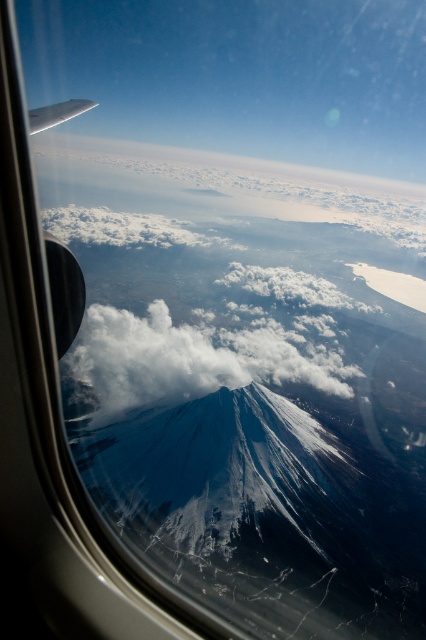
You are a pilot flying an airplane with a wingspan of 30 meters. You notice the white fluffy cloud at center and the white matte wing at upper left in your view. Based on their sizes, which one do you think is farther from the airplane?

The white fluffy cloud at center is larger in width than the white matte wing at upper left, so it is farther away from the airplane.

You are a pilot flying an airplane with a wingspan of 30 meters. You notice the white fluffy cloud at center and the white matte wing at upper left in your view. Which object is taller from your perspective?

The white fluffy cloud at center is taller than the white matte wing at upper left.

You are a passenger on an airplane and looking out the window. You notice the white fluffy cloud at center and the white matte wing at upper left. Which object is closer to the airplane?

The white fluffy cloud at center is closer to the airplane because it is positioned below the white matte wing at upper left, indicating it is nearer in the line of sight.